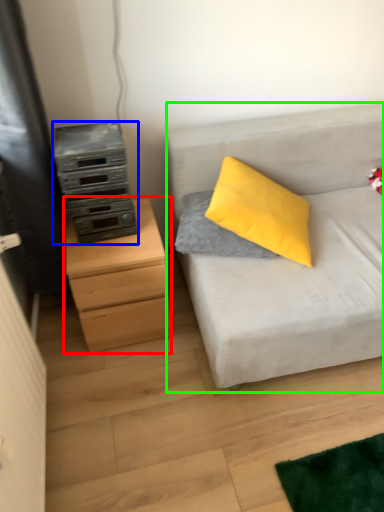
Question: Which object is the farthest from chest of drawers (highlighted by a red box)? Choose among these: appliance (highlighted by a blue box) or studio couch (highlighted by a green box).

Choices:
 (A) appliance
 (B) studio couch

Answer: (B)